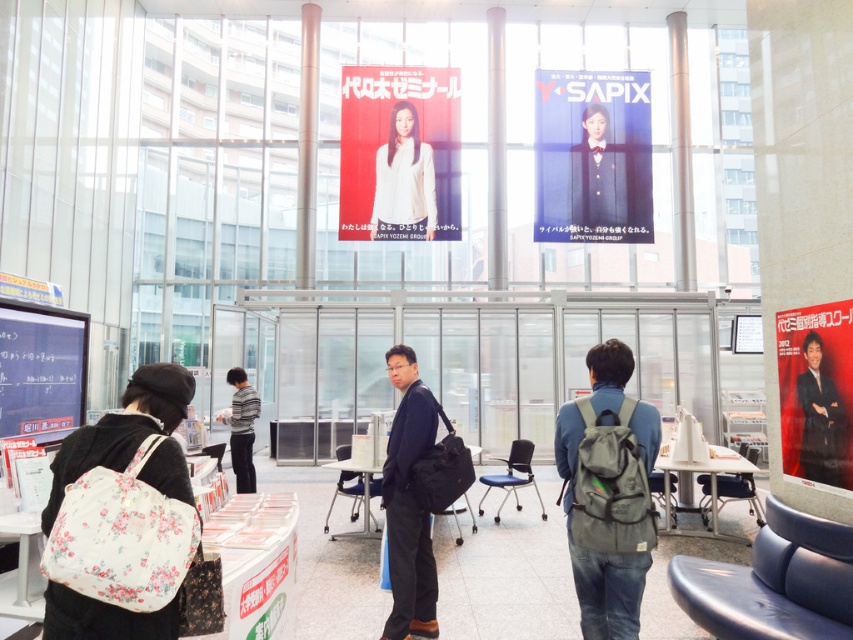
Question: Which point is closer to the camera taking this photo?

Choices:
 (A) (634, 620)
 (B) (837, 346)
 (C) (238, 460)
 (D) (422, 198)

Answer: (A)

Question: Which object appears farthest from the camera in this image?

Choices:
 (A) matte black screen at left
 (B) white matte poster at upper center
 (C) dark blue uniform at upper center
 (D) red glossy poster at right

Answer: (C)

Question: Does gray fabric backpack at center appear over floral fabric bag at lower left?

Choices:
 (A) no
 (B) yes

Answer: (A)

Question: Considering the relative positions of white matte poster at upper center and white matte shirt at upper center in the image provided, where is white matte poster at upper center located with respect to white matte shirt at upper center?

Choices:
 (A) above
 (B) below

Answer: (A)

Question: Does gray fabric backpack at center have a larger size compared to floral fabric bag at lower left?

Choices:
 (A) yes
 (B) no

Answer: (A)

Question: Considering the real-world distances, which object is farthest from the floral fabric bag at lower left?

Choices:
 (A) white matte poster at upper center
 (B) matte black poster at upper right
 (C) matte black screen at left
 (D) white matte shirt at upper center

Answer: (B)